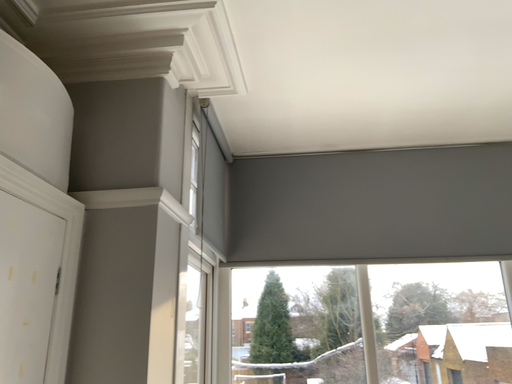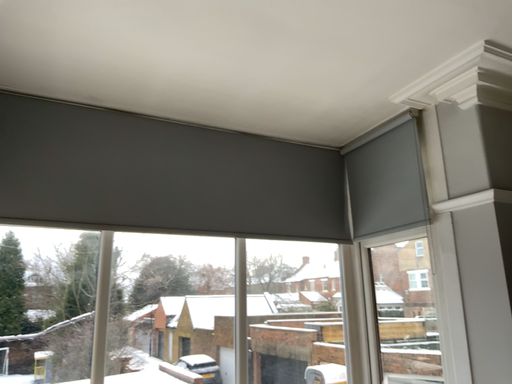
Question: Which way did the camera rotate in the video?

Choices:
 (A) rotated downward
 (B) rotated upward

Answer: (A)